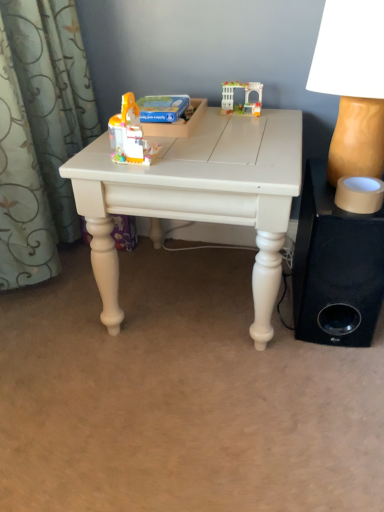
You are a GUI agent. You are given a task and a screenshot of the screen. Output one action in this format:
    pyautogui.click(x=<x>, y=<y>)
    Task: Click on the vacant space in front of black fabric speaker at lower right
    This screenshot has height=512, width=384.
    Given the screenshot: What is the action you would take?
    pyautogui.click(x=323, y=377)